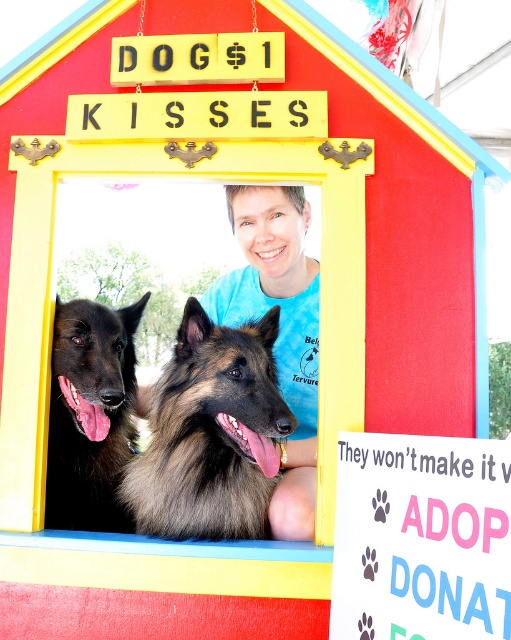
Question: Which point is farther to the camera?

Choices:
 (A) black fur dog at center
 (B) brown shaggy dog at center

Answer: (A)

Question: Is brown shaggy dog at center in front of black fur dog at center?

Choices:
 (A) no
 (B) yes

Answer: (B)

Question: Can you confirm if brown shaggy dog at center is positioned above blue cotton shirt at center?

Choices:
 (A) yes
 (B) no

Answer: (B)

Question: Which object is closer to the camera taking this photo?

Choices:
 (A) blue cotton shirt at center
 (B) brown shaggy dog at center

Answer: (B)

Question: Does brown shaggy dog at center have a smaller size compared to black fur dog at center?

Choices:
 (A) yes
 (B) no

Answer: (B)

Question: Estimate the real-world distances between objects in this image. Which object is closer to the black fur dog at center?

Choices:
 (A) blue cotton shirt at center
 (B) brown shaggy dog at center

Answer: (B)